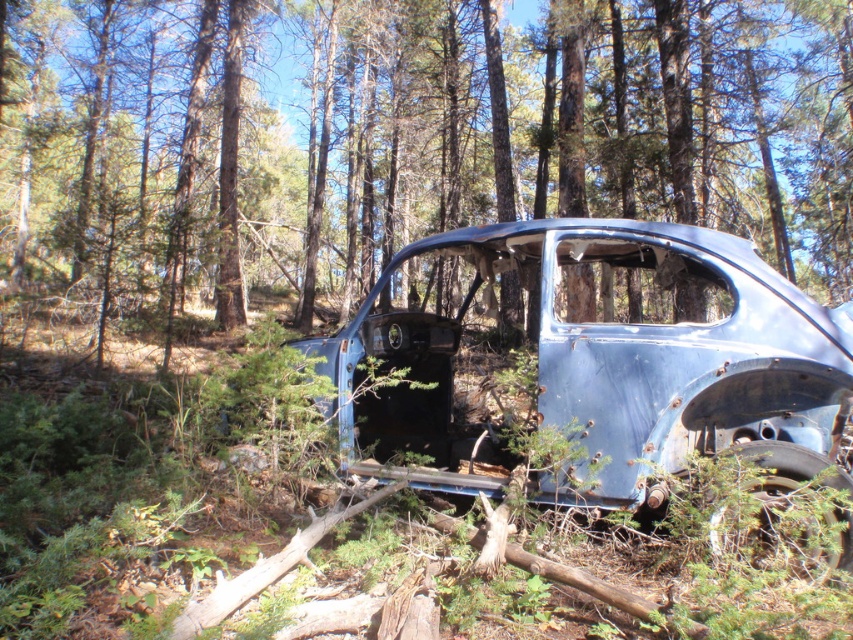
Question: Can you confirm if blue metallic car at center is bigger than rusty metal car at center?

Choices:
 (A) yes
 (B) no

Answer: (A)

Question: Can you confirm if blue metallic car at center is bigger than rusty metal car at center?

Choices:
 (A) yes
 (B) no

Answer: (A)

Question: Does blue metallic car at center have a larger size compared to rusty metal car at center?

Choices:
 (A) no
 (B) yes

Answer: (B)

Question: Which point appears farthest from the camera in this image?

Choices:
 (A) (396, 356)
 (B) (732, 120)

Answer: (B)